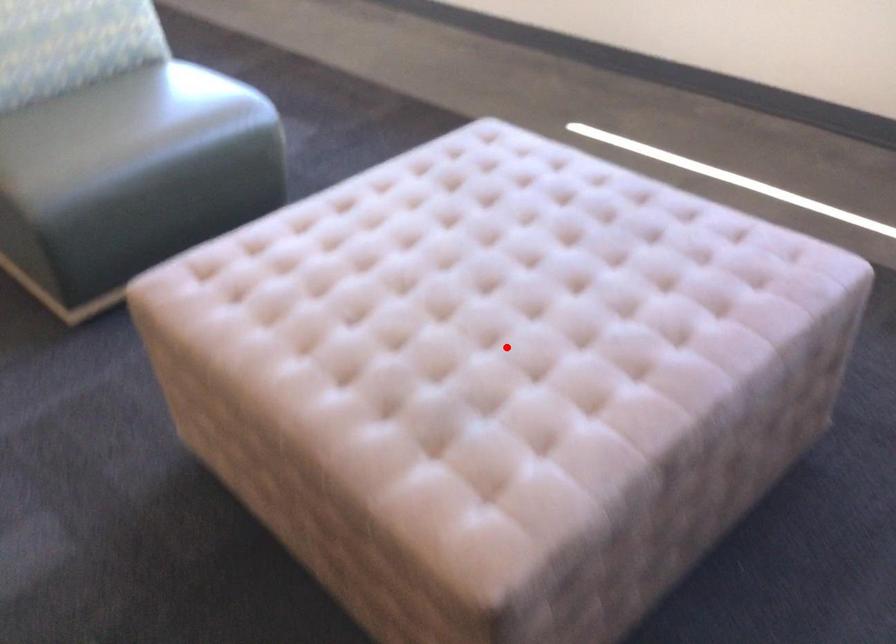
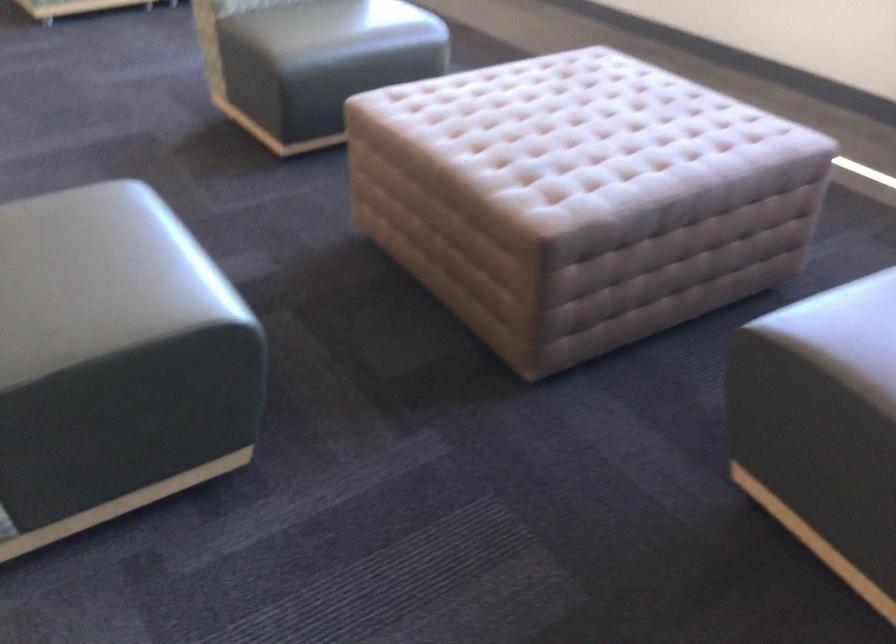
Question: A red point is marked in image1. In image2, is the corresponding 3D point closer to the camera or farther? Reply with the corresponding letter.

Choices:
 (A) The corresponding 3D point is closer.
 (B) The corresponding 3D point is farther.

Answer: (B)